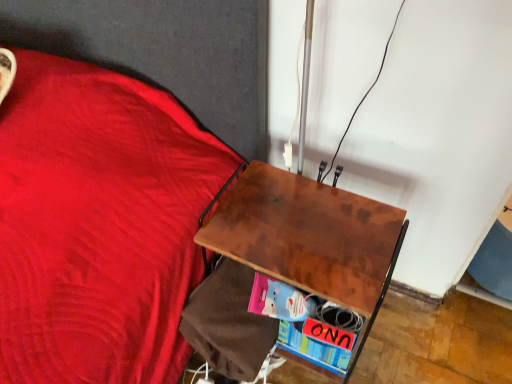
What are the coordinates of `free space above brown wood desk at center (from a real-world perspective)` in the screenshot? It's located at (306, 220).